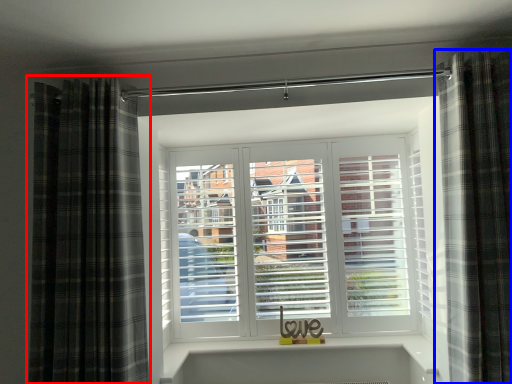
Question: Which object is further to the camera taking this photo, curtain (highlighted by a red box) or curtain (highlighted by a blue box)?

Choices:
 (A) curtain
 (B) curtain

Answer: (A)